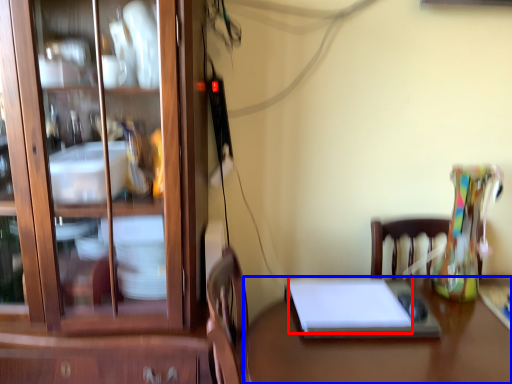
Question: Which object is closer to the camera taking this photo, notebook (highlighted by a red box) or desk (highlighted by a blue box)?

Choices:
 (A) notebook
 (B) desk

Answer: (B)